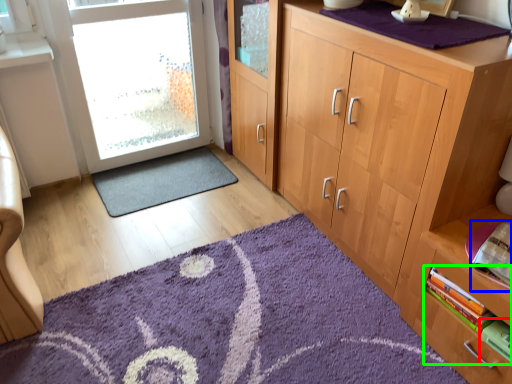
Question: Which object is positioned farthest from book (highlighted by a red box)? Select from book (highlighted by a blue box) and book (highlighted by a green box).

Choices:
 (A) book
 (B) book

Answer: (A)